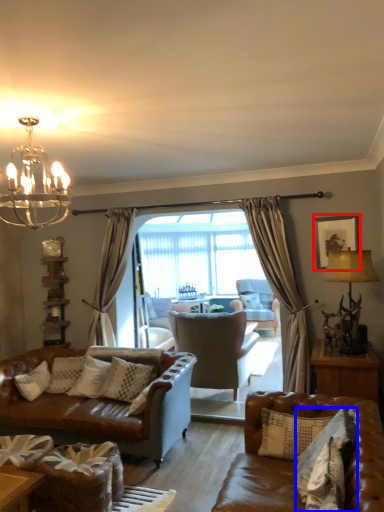
Question: Which object is further to the camera taking this photo, picture frame (highlighted by a red box) or pillow (highlighted by a blue box)?

Choices:
 (A) picture frame
 (B) pillow

Answer: (A)